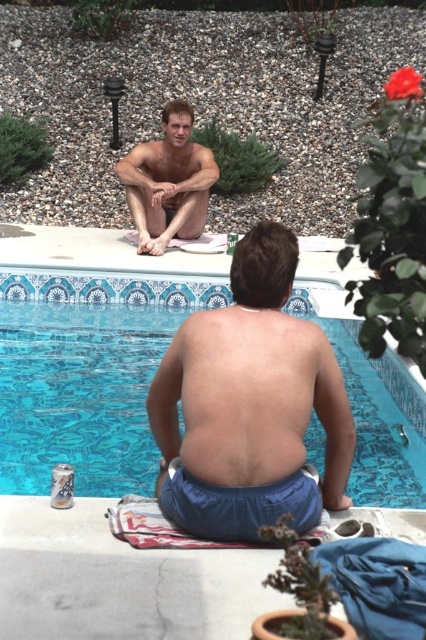
Does blue fabric shorts at center have a lesser height compared to muscular tan skin at back?

No, blue fabric shorts at center is not shorter than muscular tan skin at back.

Is point (250, 348) behind point (195, 362)?

No, (250, 348) is in front of (195, 362).

Is point (187, 385) positioned before point (204, 429)?

That is False.

You are a GUI agent. You are given a task and a screenshot of the screen. Output one action in this format:
    pyautogui.click(x=<x>, y=<y>)
    Task: Click on the blue fabric shorts at center
    This screenshot has height=640, width=426.
    Given the screenshot: What is the action you would take?
    pyautogui.click(x=250, y=403)

Is point (120, 284) closer to viewer compared to point (166, 484)?

No, (120, 284) is further to viewer.

Does blue glossy water at center have a greater height compared to blue fabric shorts at center?

Yes, blue glossy water at center is taller than blue fabric shorts at center.

Is point (11, 376) more distant than point (324, 355)?

Yes, it is.

Image resolution: width=426 pixels, height=640 pixels. What are the coordinates of `blue glossy water at center` in the screenshot? It's located at (86, 353).

Who is higher up, blue glossy water at center or muscular tan skin at back?

Positioned higher is blue glossy water at center.

In the scene shown: Who is positioned more to the right, blue glossy water at center or muscular tan skin at back?

muscular tan skin at back is more to the right.

Is point (218, 300) positioned behind point (232, 308)?

Yes, point (218, 300) is behind point (232, 308).

Where is `blue glossy water at center`? Image resolution: width=426 pixels, height=640 pixels. blue glossy water at center is located at coordinates (86, 353).